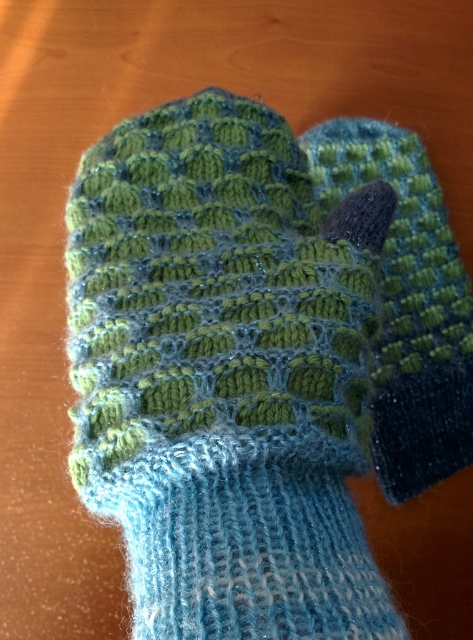
Question: Can you confirm if knitted woolen glove at center is bigger than green knitted sock at center?

Choices:
 (A) no
 (B) yes

Answer: (B)

Question: Does knitted woolen glove at center have a lesser width compared to green knitted sock at center?

Choices:
 (A) yes
 (B) no

Answer: (B)

Question: Is knitted woolen glove at center further to the viewer compared to green knitted sock at center?

Choices:
 (A) no
 (B) yes

Answer: (A)

Question: Which object is closer to the camera taking this photo?

Choices:
 (A) green knitted sock at center
 (B) knitted woolen glove at center

Answer: (B)